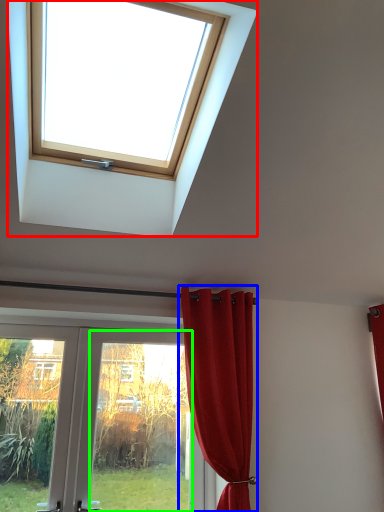
Question: Which object is positioned closest to window (highlighted by a red box)? Select from curtain (highlighted by a blue box) and glass door (highlighted by a green box).

Choices:
 (A) curtain
 (B) glass door

Answer: (A)